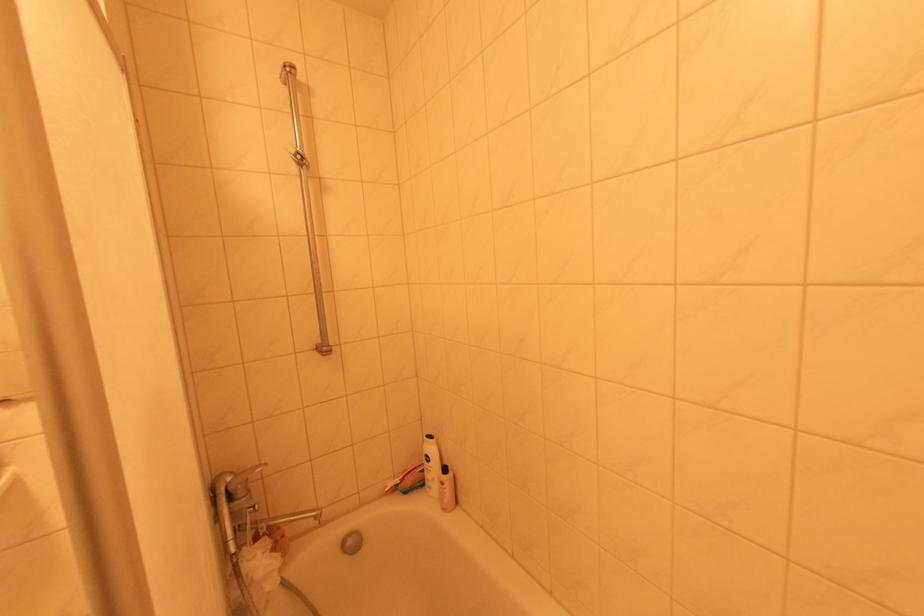
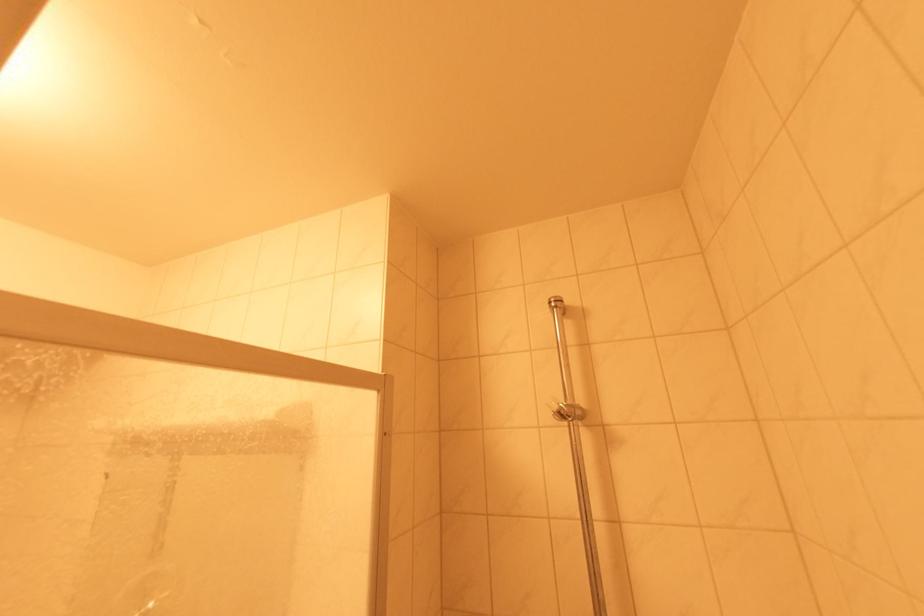
How did the camera likely rotate?

The rotation direction of the camera is left-up.